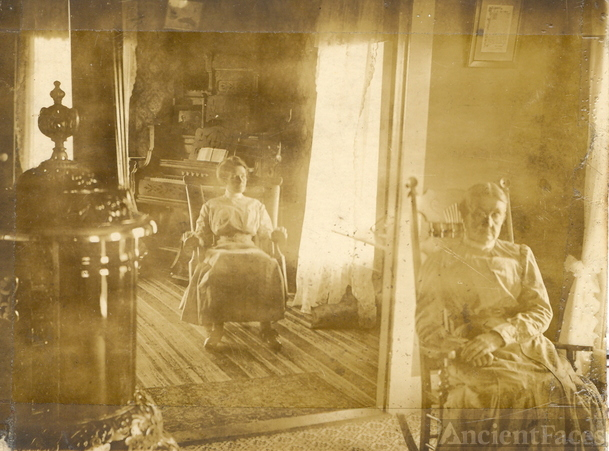
Find the location of `wooden floor`. wooden floor is located at coordinates (166, 354).